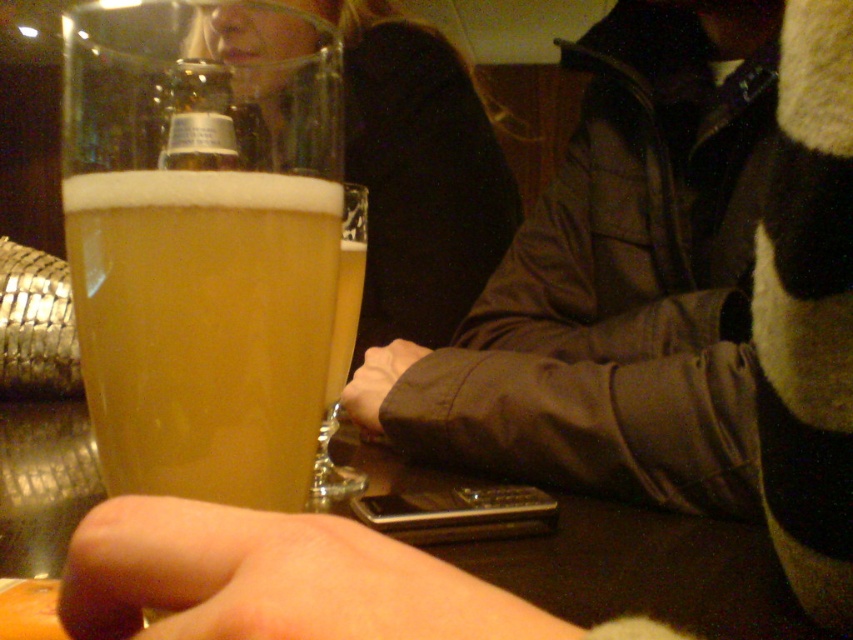
You are a bartender trying to place the translucent glass at center on the matte black hand at center. Is it possible to do so without spilling the drink?

The translucent glass at center is above the matte black hand at center, so placing the glass on the hand would likely cause the drink to spill since the hand is already supporting it from below.

You are a photographer trying to capture a closeup of the golden matte glass at center. Since the matte black hand at center is in the way, can you adjust your position to focus on the glass without the hand blocking it?

The golden matte glass at center is closer to the viewer than the matte black hand at center, so moving your camera slightly forward might allow you to focus on the glass while the hand moves out of the frame.